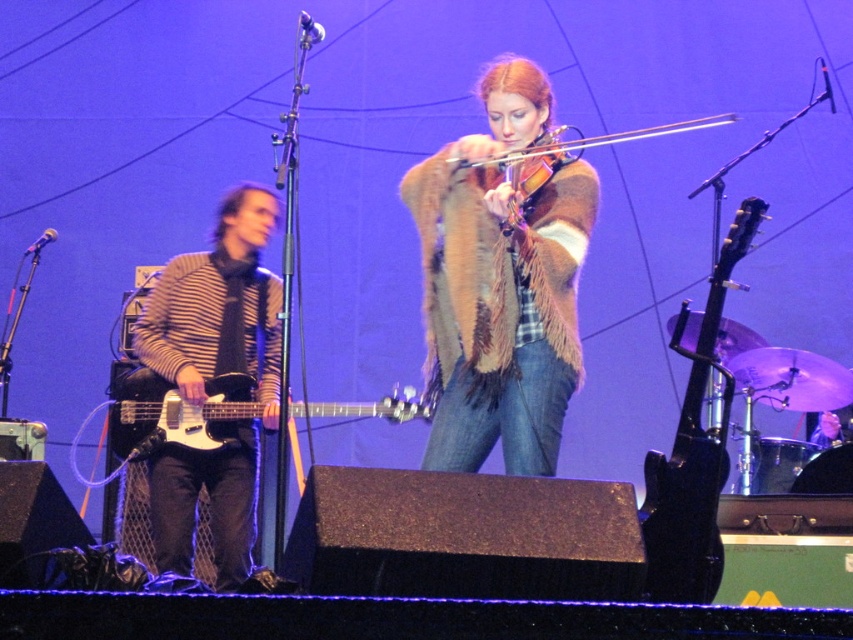
Question: Is black glossy electric guitar at right bigger than black glossy electric guitar at center?

Choices:
 (A) no
 (B) yes

Answer: (B)

Question: Which point is farther from the camera taking this photo?

Choices:
 (A) (695, 464)
 (B) (225, 433)
 (C) (521, 150)

Answer: (B)

Question: Estimate the real-world distances between objects in this image. Which object is closer to the black glossy electric guitar at center?

Choices:
 (A) black glossy electric guitar at right
 (B) fuzzy brown fur coat at center

Answer: (B)

Question: Which object is positioned farthest from the fur-like violin at center?

Choices:
 (A) wooden violin at center
 (B) black glossy electric guitar at right

Answer: (B)

Question: Does striped knit sweater at left appear under wooden violin at center?

Choices:
 (A) yes
 (B) no

Answer: (A)

Question: Where is striped knit sweater at left located in relation to black glossy electric guitar at right in the image?

Choices:
 (A) above
 (B) below

Answer: (A)